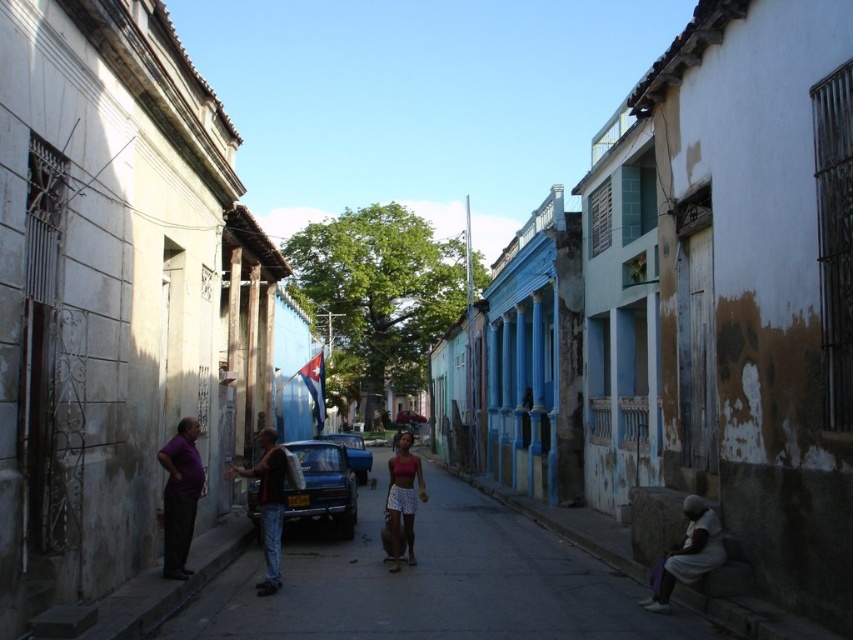
Question: Among these points, which one is nearest to the camera?

Choices:
 (A) (556, 563)
 (B) (677, 547)

Answer: (B)

Question: Which of the following is the closest to the observer?

Choices:
 (A) (503, 588)
 (B) (409, 458)
 (C) (349, 522)
 (D) (190, 492)

Answer: (D)

Question: Is smooth asphalt road at center to the left of metallic blue car at center from the viewer's perspective?

Choices:
 (A) yes
 (B) no

Answer: (B)

Question: Is dark gray fabric at lower right further to the viewer compared to matte pink tank top at center?

Choices:
 (A) no
 (B) yes

Answer: (A)

Question: Which object appears closest to the camera in this image?

Choices:
 (A) blue metallic car at center
 (B) smooth asphalt road at center
 (C) metallic blue car at center

Answer: (B)

Question: From the image, what is the correct spatial relationship of matte purple shirt at left in relation to blue metallic car at center?

Choices:
 (A) below
 (B) above

Answer: (B)